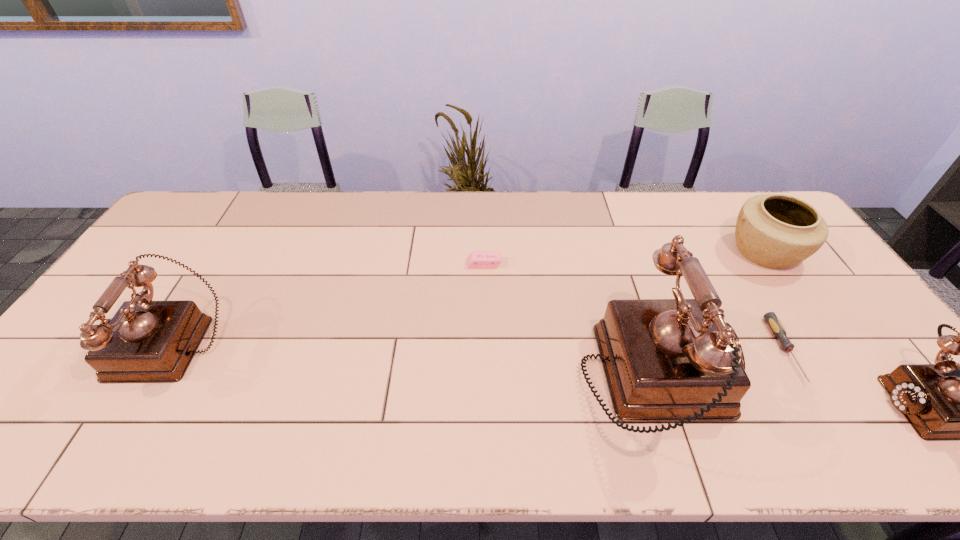
Locate an element on the screen. Image resolution: width=960 pixels, height=540 pixels. vacant space at the far left corner of the desktop is located at coordinates (222, 192).

This screenshot has width=960, height=540. What are the coordinates of `vacant point located between the second shortest telephone and the tallest object` in the screenshot? It's located at (413, 361).

The height and width of the screenshot is (540, 960). Find the location of `blank region between the eraser and the pottery`. blank region between the eraser and the pottery is located at coordinates (625, 258).

Where is `free spot between the screwdriver and the pottery`? The image size is (960, 540). free spot between the screwdriver and the pottery is located at coordinates (775, 301).

The width and height of the screenshot is (960, 540). Find the location of `object that is the fourth nearest to the pottery`. object that is the fourth nearest to the pottery is located at coordinates click(x=477, y=259).

The image size is (960, 540). I want to click on object that is the closest one to the eraser, so click(665, 360).

Identify the location of the second closest telephone relative to the fifth shortest object. Image resolution: width=960 pixels, height=540 pixels. (946, 401).

Locate an element on the screen. This screenshot has width=960, height=540. telephone that can be found as the second closest to the screwdriver is located at coordinates (665, 360).

You are a GUI agent. You are given a task and a screenshot of the screen. Output one action in this format:
    pyautogui.click(x=<x>, y=<y>)
    Task: Click on the vacant position in the image that satisfies the following two spatial constraints: 1. insert the screwdriver into a screw head; 2. on the dial of the tallest telephone
    The image size is (960, 540).
    Given the screenshot: What is the action you would take?
    pyautogui.click(x=803, y=379)

This screenshot has height=540, width=960. In order to click on vacant space that satisfies the following two spatial constraints: 1. insert the screwdriver into a screw head; 2. on the dial of the tallest telephone in this screenshot , I will do `click(803, 379)`.